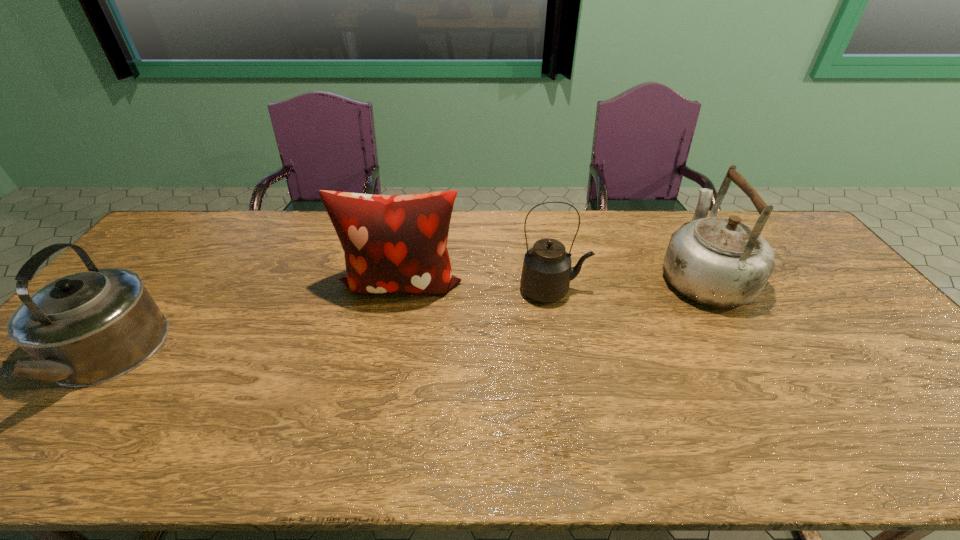
You are a GUI agent. You are given a task and a screenshot of the screen. Output one action in this format:
    pyautogui.click(x=<x>, y=<y>)
    Task: Click on the kettle that is the closest to the leftmost object
    The height and width of the screenshot is (540, 960).
    Given the screenshot: What is the action you would take?
    pyautogui.click(x=546, y=274)